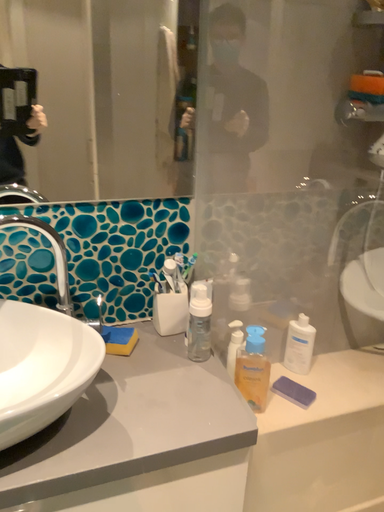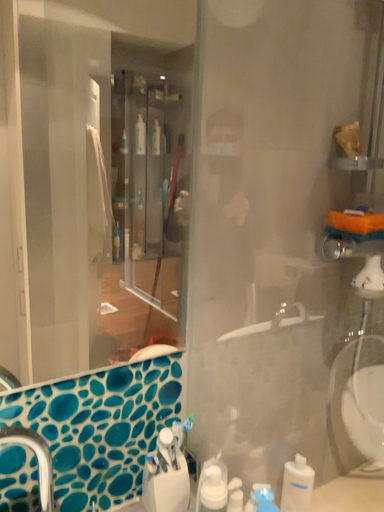
Question: How did the camera likely rotate when shooting the video?

Choices:
 (A) rotated left
 (B) rotated right

Answer: (B)